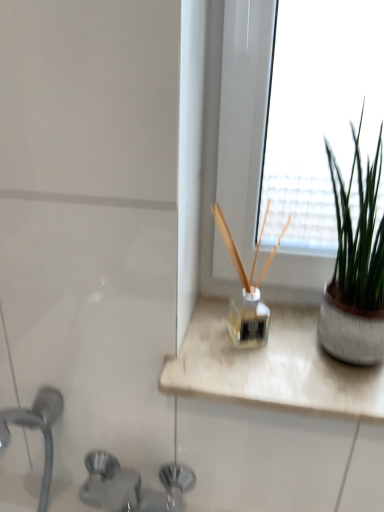
Question: In terms of size, does green matte plant at right appear bigger or smaller than brushed metal faucet at lower left?

Choices:
 (A) big
 (B) small

Answer: (B)

Question: Do you think green matte plant at right is within brushed metal faucet at lower left, or outside of it?

Choices:
 (A) outside
 (B) inside

Answer: (A)

Question: Is point (374, 216) closer or farther from the camera than point (104, 474)?

Choices:
 (A) farther
 (B) closer

Answer: (B)

Question: Is brushed metal faucet at lower left in front of or behind green matte plant at right in the image?

Choices:
 (A) front
 (B) behind

Answer: (A)

Question: Based on their sizes in the image, would you say brushed metal faucet at lower left is bigger or smaller than green matte plant at right?

Choices:
 (A) small
 (B) big

Answer: (B)

Question: Is brushed metal faucet at lower left wider or thinner than green matte plant at right?

Choices:
 (A) wide
 (B) thin

Answer: (A)

Question: From a real-world perspective, is brushed metal faucet at lower left positioned above or below green matte plant at right?

Choices:
 (A) above
 (B) below

Answer: (B)